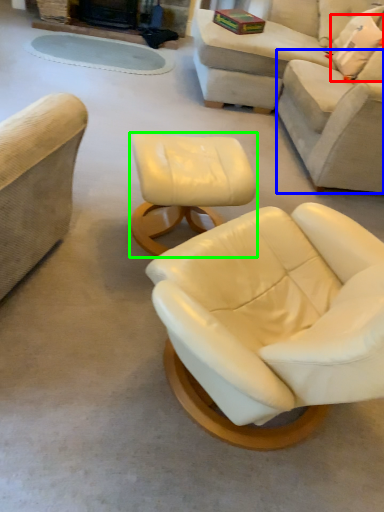
Question: Which is farther away from pillow (highlighted by a red box)? couch (highlighted by a blue box) or table (highlighted by a green box)?

Choices:
 (A) couch
 (B) table

Answer: (B)